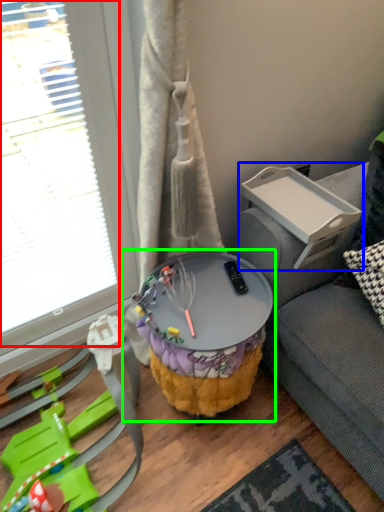
Question: Estimate the real-world distances between objects in this image. Which object is closer to glass door (highlighted by a red box), table (highlighted by a blue box) or table (highlighted by a green box)?

Choices:
 (A) table
 (B) table

Answer: (B)